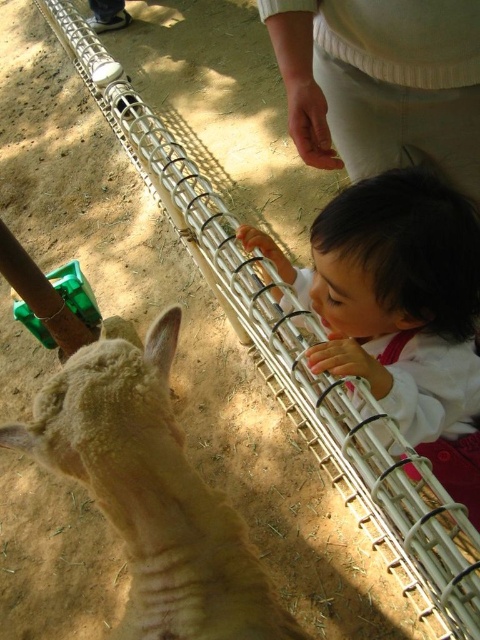
In order to click on fuzzy woolen sheep at center in this screenshot , I will do `click(152, 493)`.

Who is positioned more to the left, fuzzy woolen sheep at center or smooth white shirt at center?

fuzzy woolen sheep at center

Is point (60, 410) farther from camera compared to point (421, 449)?

No, it is not.

This screenshot has width=480, height=640. What are the coordinates of `fuzzy woolen sheep at center` in the screenshot? It's located at coord(152,493).